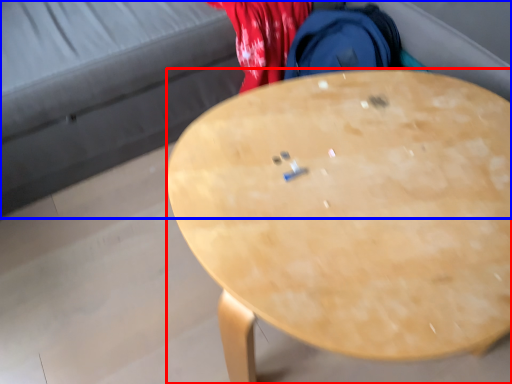
Question: Which of the following is the farthest to the observer, desk (highlighted by a red box) or studio couch (highlighted by a blue box)?

Choices:
 (A) desk
 (B) studio couch

Answer: (B)